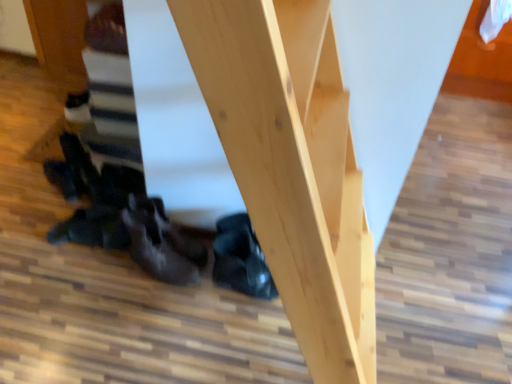
This screenshot has height=384, width=512. Identify the location of free space in front of dark brown leather shoe at center, the 2th leather shoe in the right-to-left sequence. (140, 316).